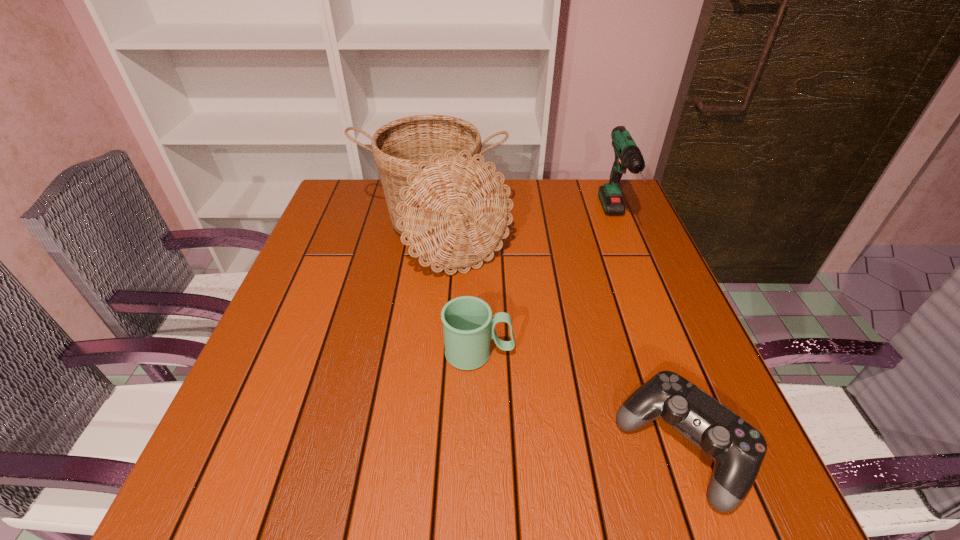
The height and width of the screenshot is (540, 960). In order to click on blank area at the near edge in this screenshot , I will do `click(347, 477)`.

Locate an element on the screen. Image resolution: width=960 pixels, height=540 pixels. free space at the left edge of the desktop is located at coordinates (335, 266).

At what (x,y) coordinates should I click in order to perform the action: click on vacant region at the right edge of the desktop. Please return your answer as a coordinate pair (x, y). Looking at the image, I should click on (623, 296).

The image size is (960, 540). In order to click on blank area at the far left corner in this screenshot , I will do `click(364, 214)`.

You are a GUI agent. You are given a task and a screenshot of the screen. Output one action in this format:
    pyautogui.click(x=<x>, y=<y>)
    Task: Click on the free space at the near left corner of the desktop
    The image size is (960, 540).
    Given the screenshot: What is the action you would take?
    pyautogui.click(x=235, y=508)

I want to click on vacant space at the near right corner, so click(752, 491).

You are a GUI agent. You are given a task and a screenshot of the screen. Output one action in this format:
    pyautogui.click(x=<x>, y=<y>)
    Task: Click on the unoccupied position between the nearest object and the third farthest object
    
    Given the screenshot: What is the action you would take?
    pyautogui.click(x=581, y=400)

Locate an element on the screen. The image size is (960, 540). free space between the third tallest object and the nearest object is located at coordinates (581, 400).

Identify the location of vacant space that's between the control and the drill. The width and height of the screenshot is (960, 540). (649, 334).

At what (x,y) coordinates should I click in order to perform the action: click on empty space between the control and the drill. Please return your answer as a coordinate pair (x, y). Image resolution: width=960 pixels, height=540 pixels. Looking at the image, I should click on (649, 334).